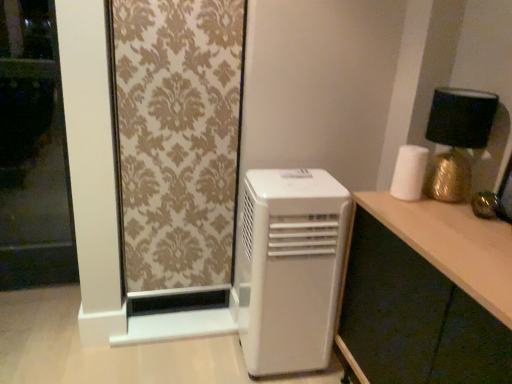
You are a GUI agent. You are given a task and a screenshot of the screen. Output one action in this format:
    pyautogui.click(x=<x>, y=<y>)
    Task: Click on the free space to the left of gold metallic table lamp at upper right
    This screenshot has height=384, width=512.
    Given the screenshot: What is the action you would take?
    pyautogui.click(x=398, y=204)